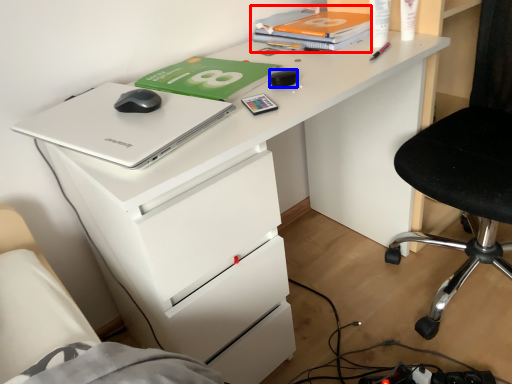
Question: Which object appears farthest to the camera in this image, book (highlighted by a red box) or stationery (highlighted by a blue box)?

Choices:
 (A) book
 (B) stationery

Answer: (A)